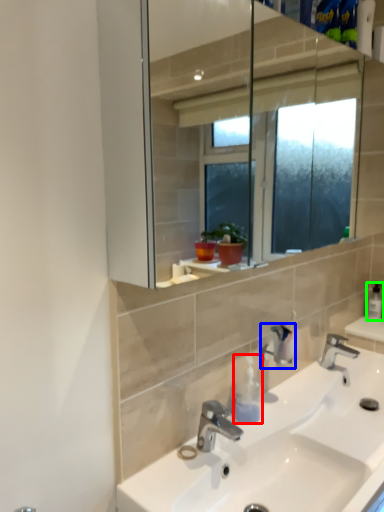
Question: Which object is positioned farthest from soap dispenser (highlighted by a red box)? Select from plumbing fixture (highlighted by a blue box) and soap dispenser (highlighted by a green box).

Choices:
 (A) plumbing fixture
 (B) soap dispenser

Answer: (B)